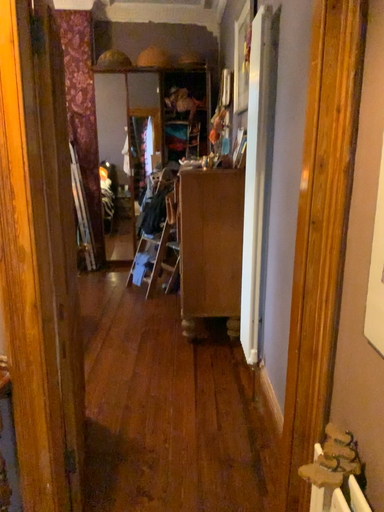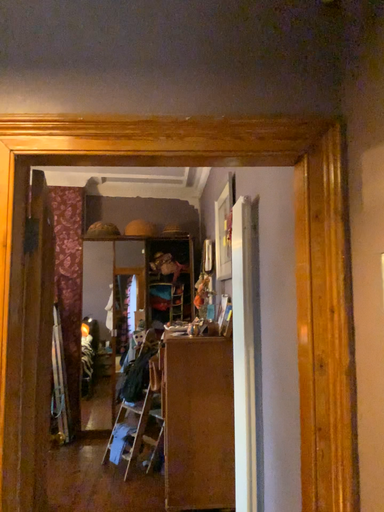
Question: Which way did the camera rotate in the video?

Choices:
 (A) rotated downward
 (B) rotated upward

Answer: (B)